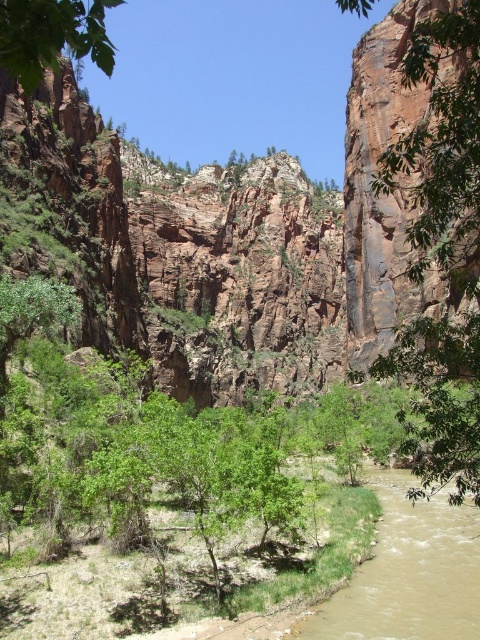
You are standing at the base of the towering red rock cliffs and see the point marked at coordinates point (408, 572). What is located at that point?

The point (408, 572) corresponds to brown muddy water at lower center.

You are an environmental scientist assessing the vegetation in the area. You observe the green leafy tree at right and the green leafy tree at upper left. Which tree has a smaller width?

The green leafy tree at right has a smaller width than the green leafy tree at upper left.

You are a photographer standing at the base of the red rock cliffs. You want to capture a photo of the point at coordinate point (395, 339). If your camera has a maximum focus range of 100 meters, will you be able to focus on the point?

The distance of point (395, 339) from camera is 100.41 meters, which exceeds the camera maximum focus range of 100 meters. Therefore, the camera cannot focus on the point.